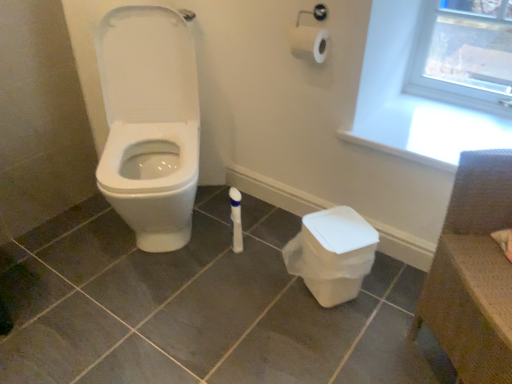
Question: Is white plastic potty at lower right bigger or smaller than brown woven chair at upper right?

Choices:
 (A) small
 (B) big

Answer: (A)

Question: Considering the positions of white plastic potty at lower right and brown woven chair at upper right in the image, is white plastic potty at lower right taller or shorter than brown woven chair at upper right?

Choices:
 (A) tall
 (B) short

Answer: (B)

Question: Considering the real-world distances, which object is farthest from the white plastic potty at lower right?

Choices:
 (A) white plastic window frame at upper right
 (B) brown woven chair at upper right

Answer: (A)

Question: Which object is the farthest from the white plastic potty at lower right?

Choices:
 (A) white plastic window frame at upper right
 (B) brown woven chair at upper right

Answer: (A)